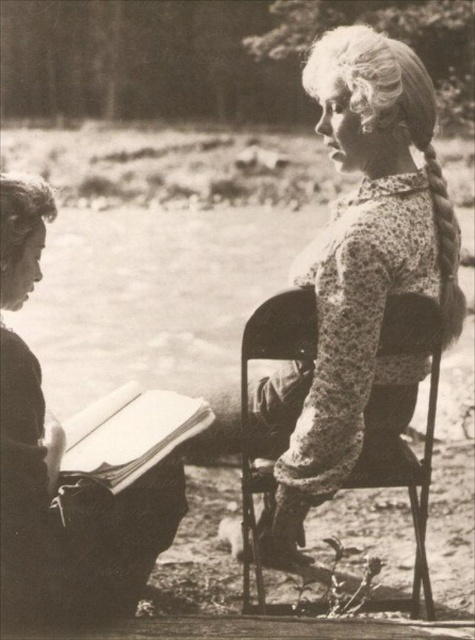
Question: Which point is closer to the camera taking this photo?

Choices:
 (A) (301, 262)
 (B) (415, 586)
 (C) (144, 467)
 (D) (45, 483)

Answer: (D)

Question: Which point is closer to the camera?

Choices:
 (A) (121, 595)
 (B) (336, 148)
 (C) (381, 477)
 (D) (183, 436)

Answer: (A)

Question: Is smooth paper book at left in front of metallic black chair at center?

Choices:
 (A) yes
 (B) no

Answer: (A)

Question: Which point is closer to the camera?

Choices:
 (A) floral-patterned fabric at center-right
 (B) metallic black chair at center
 (C) smooth paper book at left

Answer: (C)

Question: Is floral-patterned fabric at center-right closer to camera compared to smooth paper book at left?

Choices:
 (A) yes
 (B) no

Answer: (B)

Question: Does smooth paper book at left have a larger size compared to thick paper book at lower left?

Choices:
 (A) yes
 (B) no

Answer: (A)